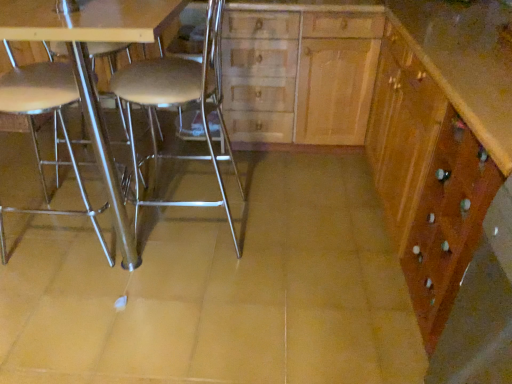
Question: Is metallic silver chair at left, placed as the first chair when sorted from left to right, positioned behind metallic silver stool at center, placed as the 2th chair when sorted from left to right?

Choices:
 (A) no
 (B) yes

Answer: (A)

Question: Does metallic silver chair at left, placed as the first chair when sorted from left to right, come in front of metallic silver stool at center, placed as the 2th chair when sorted from left to right?

Choices:
 (A) yes
 (B) no

Answer: (A)

Question: Is metallic silver chair at left, placed as the first chair when sorted from left to right, taller than metallic silver stool at center, the first chair from the right?

Choices:
 (A) no
 (B) yes

Answer: (B)

Question: From the image's perspective, is metallic silver chair at left, arranged as the second chair when viewed from the right, over metallic silver stool at center, placed as the 2th chair when sorted from left to right?

Choices:
 (A) yes
 (B) no

Answer: (B)

Question: Can metallic silver stool at center, placed as the 2th chair when sorted from left to right, be found inside metallic silver chair at left, arranged as the second chair when viewed from the right?

Choices:
 (A) no
 (B) yes

Answer: (A)

Question: From a real-world perspective, relative to metallic silver table at center, is wooden cabinet at center vertically above or below?

Choices:
 (A) above
 (B) below

Answer: (B)

Question: In terms of size, does wooden cabinet at center appear bigger or smaller than metallic silver table at center?

Choices:
 (A) small
 (B) big

Answer: (A)

Question: Is wooden cabinet at center taller or shorter than metallic silver table at center?

Choices:
 (A) short
 (B) tall

Answer: (A)

Question: In the image, is wooden cabinet at center on the left side or the right side of metallic silver table at center?

Choices:
 (A) right
 (B) left

Answer: (A)

Question: Considering the positions of wooden cabinet at right and metallic silver stool at center, placed as the 2th chair when sorted from left to right, in the image, is wooden cabinet at right bigger or smaller than metallic silver stool at center, placed as the 2th chair when sorted from left to right,?

Choices:
 (A) big
 (B) small

Answer: (A)

Question: Is wooden cabinet at right in front of or behind metallic silver stool at center, the first chair from the right, in the image?

Choices:
 (A) behind
 (B) front

Answer: (B)

Question: Is point (449, 18) positioned closer to the camera than point (210, 82)?

Choices:
 (A) farther
 (B) closer

Answer: (A)

Question: From the image's perspective, relative to metallic silver stool at center, the first chair from the right, is wooden cabinet at right above or below?

Choices:
 (A) above
 (B) below

Answer: (A)

Question: Is metallic silver stool at center, placed as the 2th chair when sorted from left to right, in front of or behind metallic silver chair at left, arranged as the second chair when viewed from the right, in the image?

Choices:
 (A) front
 (B) behind

Answer: (B)

Question: Which is correct: metallic silver stool at center, placed as the 2th chair when sorted from left to right, is inside metallic silver chair at left, arranged as the second chair when viewed from the right, or outside of it?

Choices:
 (A) outside
 (B) inside

Answer: (A)